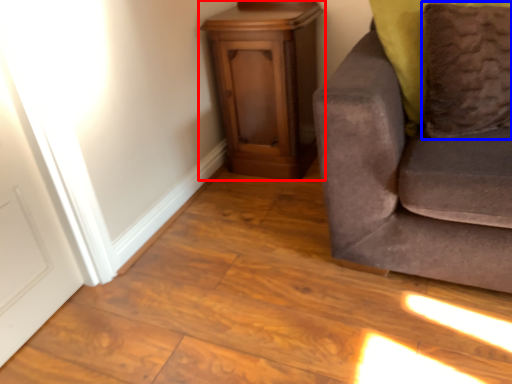
Question: Which object appears closest to the camera in this image, furniture (highlighted by a red box) or pillow (highlighted by a blue box)?

Choices:
 (A) furniture
 (B) pillow

Answer: (B)